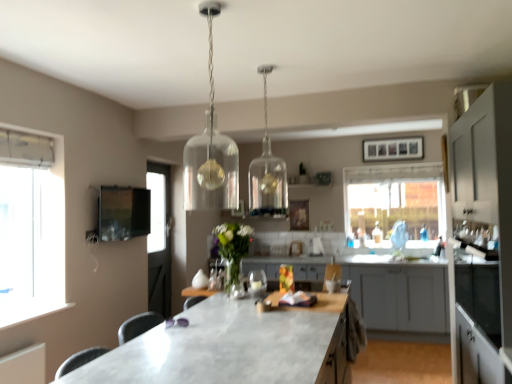
Question: From the image's perspective, is matte black tv at upper left beneath white matte cabinet at right, placed as the 2th cabinetry when sorted from back to front?

Choices:
 (A) no
 (B) yes

Answer: (A)

Question: Considering the relative sizes of matte black tv at upper left and white matte cabinet at right, placed as the 2th cabinetry when sorted from back to front, in the image provided, is matte black tv at upper left bigger than white matte cabinet at right, placed as the 2th cabinetry when sorted from back to front,?

Choices:
 (A) yes
 (B) no

Answer: (B)

Question: Is the depth of matte black tv at upper left less than that of white matte cabinet at right, placed as the 2th cabinetry when sorted from back to front?

Choices:
 (A) yes
 (B) no

Answer: (B)

Question: Is matte black tv at upper left shorter than white matte cabinet at right, placed as the 2th cabinetry when sorted from back to front?

Choices:
 (A) yes
 (B) no

Answer: (A)

Question: Does matte black tv at upper left turn towards white matte cabinet at right, the 1th cabinetry when ordered from front to back?

Choices:
 (A) no
 (B) yes

Answer: (B)

Question: In terms of height, does transparent glass window at center look taller or shorter compared to clear glass pendant light at upper center, positioned as the second lamp in front-to-back order?

Choices:
 (A) tall
 (B) short

Answer: (A)

Question: From a real-world perspective, is transparent glass window at center above or below clear glass pendant light at upper center, the 1th lamp when ordered from back to front?

Choices:
 (A) above
 (B) below

Answer: (B)

Question: Would you say transparent glass window at center is to the left or to the right of clear glass pendant light at upper center, positioned as the second lamp in front-to-back order, in the picture?

Choices:
 (A) right
 (B) left

Answer: (A)

Question: Is point coord(428,175) positioned closer to the camera than point coord(267,142)?

Choices:
 (A) closer
 (B) farther

Answer: (B)

Question: From their relative heights in the image, would you say white matte cabinet at right, the 1th cabinetry when ordered from front to back, is taller or shorter than transparent glass window at center?

Choices:
 (A) short
 (B) tall

Answer: (B)

Question: Based on their positions, is white matte cabinet at right, placed as the 2th cabinetry when sorted from back to front, located to the left or right of transparent glass window at center?

Choices:
 (A) right
 (B) left

Answer: (B)

Question: Relative to transparent glass window at center, is white matte cabinet at right, the 1th cabinetry when ordered from front to back, in front or behind?

Choices:
 (A) behind
 (B) front

Answer: (B)

Question: Is white matte cabinet at right, placed as the 2th cabinetry when sorted from back to front, inside the boundaries of transparent glass window at center, or outside?

Choices:
 (A) inside
 (B) outside

Answer: (B)

Question: Is point pyautogui.click(x=505, y=150) positioned closer to the camera than point pyautogui.click(x=228, y=244)?

Choices:
 (A) closer
 (B) farther

Answer: (A)

Question: Looking at their shapes, would you say white matte cabinet at right, placed as the 2th cabinetry when sorted from back to front, is wider or thinner than translucent glass vase at center?

Choices:
 (A) thin
 (B) wide

Answer: (B)